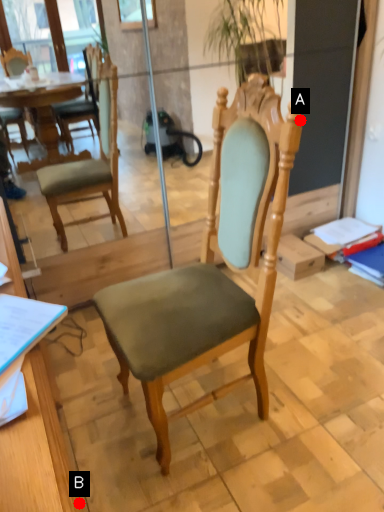
Question: Two points are circled on the image, labeled by A and B beside each circle. Which point is farther from the camera taking this photo?

Choices:
 (A) A is further
 (B) B is further

Answer: (A)